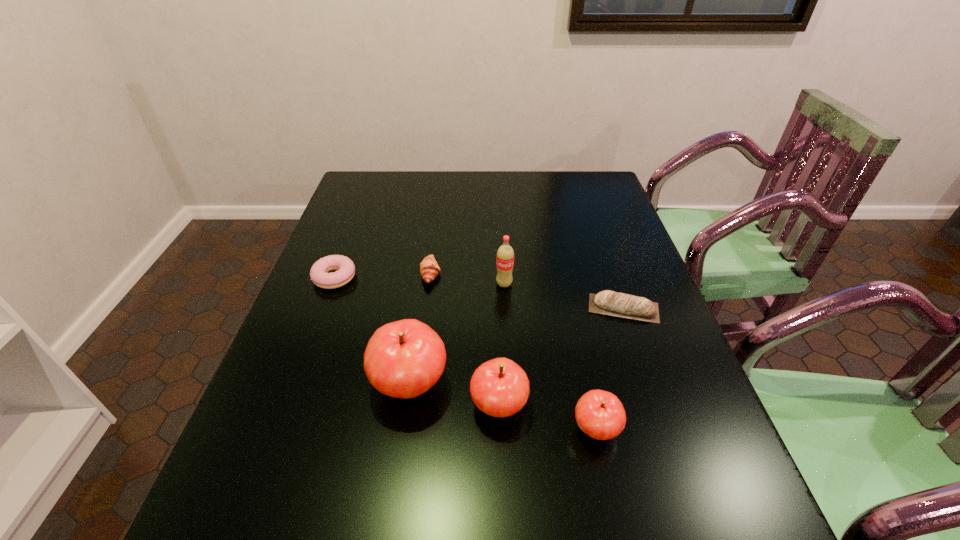
At what (x,y) coordinates should I click in order to perform the action: click on blank region between the leftmost apple and the pita bread. Please return your answer as a coordinate pair (x, y). This screenshot has width=960, height=540. Looking at the image, I should click on (516, 347).

Where is `free space between the soda and the doughnut`? The height and width of the screenshot is (540, 960). free space between the soda and the doughnut is located at coordinates (420, 281).

Locate an element on the screen. object that ranks as the sixth closest to the pastry is located at coordinates tap(600, 414).

I want to click on object that stands as the closest to the soda, so click(429, 268).

This screenshot has height=540, width=960. In order to click on apple that can be found as the third closest to the doughnut in this screenshot , I will do `click(600, 414)`.

Locate an element on the screen. This screenshot has width=960, height=540. apple that is the third closest to the pita bread is located at coordinates (403, 359).

The image size is (960, 540). I want to click on vacant space that satisfies the following two spatial constraints: 1. on the front-facing side of the fourth nearest object; 2. on the right side of the pastry, so click(x=426, y=308).

Find the location of a particular element. The width and height of the screenshot is (960, 540). free region that satisfies the following two spatial constraints: 1. on the front-facing side of the pastry; 2. on the right side of the second apple from right to left is located at coordinates (413, 406).

Locate an element on the screen. The image size is (960, 540). free point that satisfies the following two spatial constraints: 1. on the front side of the fourth nearest object; 2. on the right side of the doughnut is located at coordinates (323, 308).

Where is `free space in the image that satisfies the following two spatial constraints: 1. on the front side of the doughnut; 2. on the right side of the pita bread`? free space in the image that satisfies the following two spatial constraints: 1. on the front side of the doughnut; 2. on the right side of the pita bread is located at coordinates (323, 308).